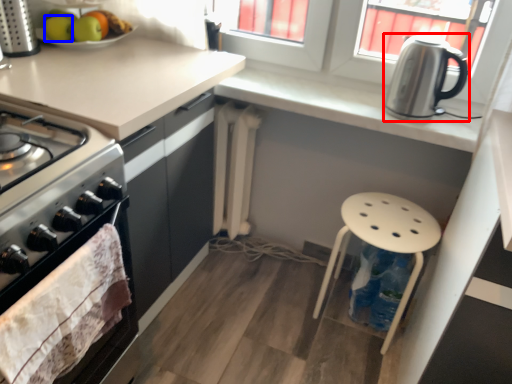
Question: Which object is closer to the camera taking this photo, kettle (highlighted by a red box) or apple (highlighted by a blue box)?

Choices:
 (A) kettle
 (B) apple

Answer: (A)